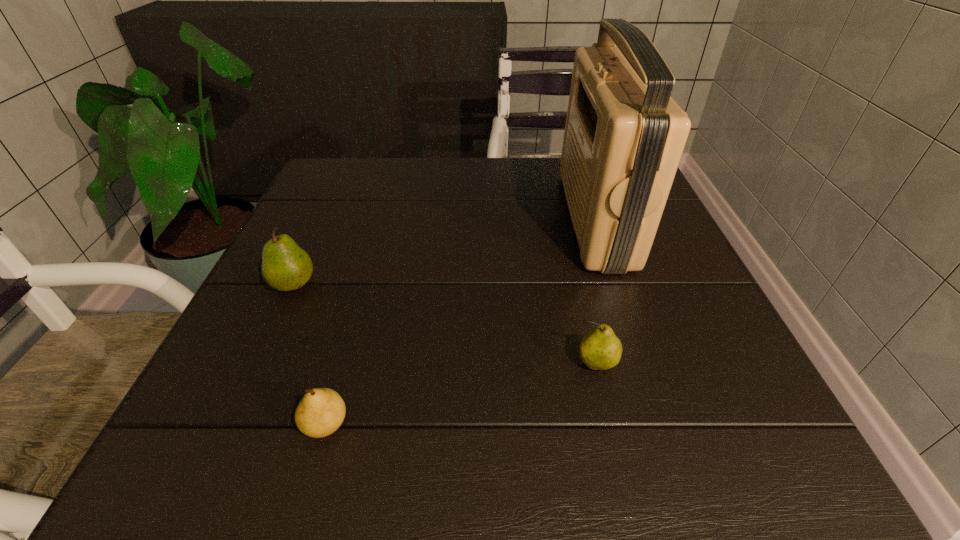
Find the location of a particular element. empty space between the rightmost pear and the leftmost object is located at coordinates (x=444, y=325).

Where is `free spot between the second nearest object and the second object from left to right`? free spot between the second nearest object and the second object from left to right is located at coordinates (461, 394).

Image resolution: width=960 pixels, height=540 pixels. In order to click on vacant region between the tallest object and the second pear from right to left in this screenshot , I will do `click(461, 321)`.

Where is `object that stands as the closest to the second farthest pear`? The height and width of the screenshot is (540, 960). object that stands as the closest to the second farthest pear is located at coordinates (624, 136).

Identify which object is the third closest to the nearest pear. Please provide its 2D coordinates. Your answer should be formatted as a tuple, i.e. [(x, y)], where the tuple contains the x and y coordinates of a point satisfying the conditions above.

[(624, 136)]

Locate an element on the screen. pear that stands as the second closest to the third object from right to left is located at coordinates (601, 349).

Select which pear appears as the second closest to the nearest pear. Please provide its 2D coordinates. Your answer should be formatted as a tuple, i.e. [(x, y)], where the tuple contains the x and y coordinates of a point satisfying the conditions above.

[(601, 349)]

Where is `blank area in the image that satisfies the following two spatial constraints: 1. on the back side of the nearest object; 2. on the left side of the third farthest object`? Image resolution: width=960 pixels, height=540 pixels. blank area in the image that satisfies the following two spatial constraints: 1. on the back side of the nearest object; 2. on the left side of the third farthest object is located at coordinates (343, 364).

Identify the location of free space that satisfies the following two spatial constraints: 1. on the front side of the second farthest pear; 2. on the right side of the leftmost object. (257, 364).

You are a GUI agent. You are given a task and a screenshot of the screen. Output one action in this format:
    pyautogui.click(x=<x>, y=<y>)
    Task: Click on the free location that satisfies the following two spatial constraints: 1. on the front side of the second nearest pear; 2. on the right side of the farthest pear
    
    Given the screenshot: What is the action you would take?
    (x=257, y=364)